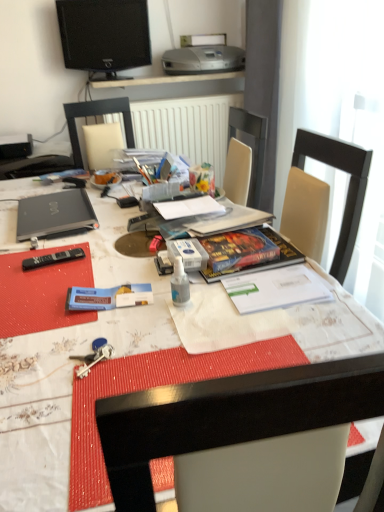
This screenshot has height=512, width=384. What are the coordinates of `vacant area that is in front of transparent plastic spray bottle at center` in the screenshot? It's located at (183, 340).